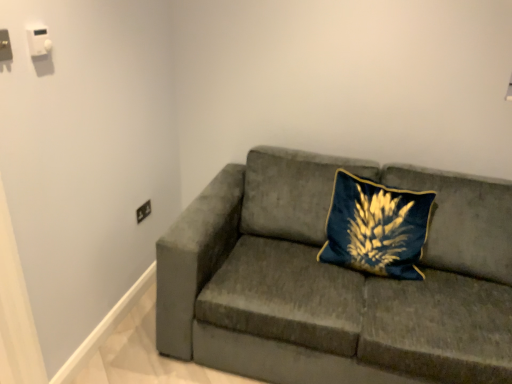
What do you see at coordinates (38, 40) in the screenshot?
I see `white plastic switch at upper left, which is the second electric outlet from right to left` at bounding box center [38, 40].

In order to face velvet gray couch at center, should I rotate leftwards or rightwards?

Rotate right and turn 13.763 degrees.

Image resolution: width=512 pixels, height=384 pixels. What do you see at coordinates (143, 211) in the screenshot? I see `black plastic electrical outlet at lower left, arranged as the 3th electric outlet when viewed from the left` at bounding box center [143, 211].

You are a GUI agent. You are given a task and a screenshot of the screen. Output one action in this format:
    pyautogui.click(x=<x>, y=<y>)
    Task: Click on the white plastic switch at upper left, acting as the second electric outlet starting from the back
    The width and height of the screenshot is (512, 384).
    Given the screenshot: What is the action you would take?
    click(x=38, y=40)

From a real-world perspective, which object rests below the other?

In real-world perspective, black plastic electrical outlet at lower left, which is the 1th electric outlet from right to left, is lower.

You are a GUI agent. You are given a task and a screenshot of the screen. Output one action in this format:
    pyautogui.click(x=<x>, y=<y>)
    Task: Click on the pillow below the black plastic electrical outlet at lower left, which ranks as the 3th electric outlet in front-to-back order (from the image's perspective)
    This screenshot has height=384, width=512.
    Given the screenshot: What is the action you would take?
    pyautogui.click(x=376, y=227)

Considering the relative sizes of black plastic electrical outlet at lower left, placed as the first electric outlet when sorted from bottom to top, and velvet blue pillow at center in the image provided, is black plastic electrical outlet at lower left, placed as the first electric outlet when sorted from bottom to top, smaller than velvet blue pillow at center?

Yes.

Which object is closer to the camera, matte black socket at upper left, positioned as the 1th electric outlet in left-to-right order, or velvet blue pillow at center?

matte black socket at upper left, positioned as the 1th electric outlet in left-to-right order.

In terms of height, does matte black socket at upper left, which ranks as the 3th electric outlet in back-to-front order, look taller or shorter compared to velvet blue pillow at center?

Clearly, matte black socket at upper left, which ranks as the 3th electric outlet in back-to-front order, is shorter compared to velvet blue pillow at center.

From the image's perspective, does matte black socket at upper left, which is the first electric outlet from front to back, appear higher than velvet blue pillow at center?

Indeed, from the image's perspective, matte black socket at upper left, which is the first electric outlet from front to back, is shown above velvet blue pillow at center.

Considering the relative positions of matte black socket at upper left, the second electric outlet viewed from the top, and velvet blue pillow at center in the image provided, is matte black socket at upper left, the second electric outlet viewed from the top, to the right of velvet blue pillow at center from the viewer's perspective?

No, matte black socket at upper left, the second electric outlet viewed from the top, is not to the right of velvet blue pillow at center.

How far apart are white plastic switch at upper left, which ranks as the 2th electric outlet in left-to-right order, and matte black socket at upper left, positioned as the 1th electric outlet in left-to-right order?

A distance of 4.49 inches exists between white plastic switch at upper left, which ranks as the 2th electric outlet in left-to-right order, and matte black socket at upper left, positioned as the 1th electric outlet in left-to-right order.

Does white plastic switch at upper left, marked as the second electric outlet in a front-to-back arrangement, lie in front of matte black socket at upper left, which ranks as the 3th electric outlet in back-to-front order?

No, it is not.

The height and width of the screenshot is (384, 512). Find the location of `electric outlet to the left of white plastic switch at upper left, marked as the second electric outlet in a front-to-back arrangement`. electric outlet to the left of white plastic switch at upper left, marked as the second electric outlet in a front-to-back arrangement is located at coordinates (5, 46).

Is black plastic electrical outlet at lower left, placed as the first electric outlet when sorted from bottom to top, at the right side of matte black socket at upper left, which ranks as the 3th electric outlet in back-to-front order?

Correct, you'll find black plastic electrical outlet at lower left, placed as the first electric outlet when sorted from bottom to top, to the right of matte black socket at upper left, which ranks as the 3th electric outlet in back-to-front order.

Considering the sizes of objects black plastic electrical outlet at lower left, arranged as the 3th electric outlet when viewed from the left, and matte black socket at upper left, which is the first electric outlet from front to back, in the image provided, who is wider, black plastic electrical outlet at lower left, arranged as the 3th electric outlet when viewed from the left, or matte black socket at upper left, which is the first electric outlet from front to back,?

black plastic electrical outlet at lower left, arranged as the 3th electric outlet when viewed from the left.

Does black plastic electrical outlet at lower left, which is the 1th electric outlet from right to left, have a greater height compared to matte black socket at upper left, arranged as the third electric outlet when viewed from the right?

No, black plastic electrical outlet at lower left, which is the 1th electric outlet from right to left, is not taller than matte black socket at upper left, arranged as the third electric outlet when viewed from the right.

From a real-world perspective, which object rests below the other?

black plastic electrical outlet at lower left, which ranks as the 3th electric outlet in front-to-back order.

Which is in front, white plastic switch at upper left, acting as the second electric outlet starting from the back, or velvet blue pillow at center?

white plastic switch at upper left, acting as the second electric outlet starting from the back, is closer to the camera.

Is point (44, 48) closer or farther from the camera than point (429, 203)?

Point (44, 48) appears to be closer to the viewer than point (429, 203).

From a real-world perspective, which object stands above the other?

white plastic switch at upper left, marked as the 3th electric outlet in a bottom-to-top arrangement.

Is white plastic switch at upper left, which ranks as the 2th electric outlet in left-to-right order, beside velvet gray couch at center?

No, white plastic switch at upper left, which ranks as the 2th electric outlet in left-to-right order, is not beside velvet gray couch at center.

Considering the points (38, 36) and (374, 301), which point is behind, point (38, 36) or point (374, 301)?

The point (374, 301) is behind.

How different are the orientations of white plastic switch at upper left, placed as the first electric outlet when sorted from top to bottom, and velvet gray couch at center in degrees?

The facing directions of white plastic switch at upper left, placed as the first electric outlet when sorted from top to bottom, and velvet gray couch at center are 92.8 degrees apart.

Consider the image. Does white plastic switch at upper left, placed as the first electric outlet when sorted from top to bottom, have a smaller size compared to velvet gray couch at center?

Correct, white plastic switch at upper left, placed as the first electric outlet when sorted from top to bottom, occupies less space than velvet gray couch at center.

From the image's perspective, is black plastic electrical outlet at lower left, the first electric outlet viewed from the back, positioned above or below velvet gray couch at center?

From the image's perspective, black plastic electrical outlet at lower left, the first electric outlet viewed from the back, appears above velvet gray couch at center.

Measure the distance between black plastic electrical outlet at lower left, which ranks as the 3th electric outlet in front-to-back order, and velvet gray couch at center.

3.34 feet.

Is black plastic electrical outlet at lower left, which is the 1th electric outlet from right to left, thinner than velvet gray couch at center?

Correct, the width of black plastic electrical outlet at lower left, which is the 1th electric outlet from right to left, is less than that of velvet gray couch at center.

The width and height of the screenshot is (512, 384). Identify the location of pillow on the right of black plastic electrical outlet at lower left, placed as the first electric outlet when sorted from bottom to top. (376, 227).

From the velvet blue pillow at center, count 2nd electric outlets forward and point to it. Please provide its 2D coordinates.

[(5, 46)]

From the image, which object appears to be farther from velvet blue pillow at center, matte black socket at upper left, which ranks as the 3th electric outlet in back-to-front order, or black plastic electrical outlet at lower left, which is the 1th electric outlet from right to left?

matte black socket at upper left, which ranks as the 3th electric outlet in back-to-front order, is further to velvet blue pillow at center.

Estimate the real-world distances between objects in this image. Which object is further from matte black socket at upper left, which is the first electric outlet from front to back, velvet blue pillow at center or white plastic switch at upper left, placed as the first electric outlet when sorted from top to bottom?

velvet blue pillow at center is further to matte black socket at upper left, which is the first electric outlet from front to back.

In the scene shown: From the image, which object appears to be nearer to black plastic electrical outlet at lower left, which is the 1th electric outlet from right to left, matte black socket at upper left, the second electric outlet viewed from the top, or white plastic switch at upper left, placed as the first electric outlet when sorted from top to bottom?

white plastic switch at upper left, placed as the first electric outlet when sorted from top to bottom, lies closer to black plastic electrical outlet at lower left, which is the 1th electric outlet from right to left, than the other object.

From the image, which object appears to be nearer to velvet gray couch at center, velvet blue pillow at center or matte black socket at upper left, which ranks as the 3th electric outlet in back-to-front order?

velvet blue pillow at center lies closer to velvet gray couch at center than the other object.

When comparing their distances from velvet gray couch at center, does white plastic switch at upper left, which ranks as the 2th electric outlet in left-to-right order, or black plastic electrical outlet at lower left, the first electric outlet viewed from the back, seem closer?

black plastic electrical outlet at lower left, the first electric outlet viewed from the back.

From the image, which object appears to be farther from velvet gray couch at center, black plastic electrical outlet at lower left, which is the 1th electric outlet from right to left, or velvet blue pillow at center?

black plastic electrical outlet at lower left, which is the 1th electric outlet from right to left, lies further to velvet gray couch at center than the other object.

When comparing their distances from white plastic switch at upper left, acting as the second electric outlet starting from the back, does matte black socket at upper left, the second electric outlet viewed from the top, or velvet gray couch at center seem closer?

Based on the image, matte black socket at upper left, the second electric outlet viewed from the top, appears to be nearer to white plastic switch at upper left, acting as the second electric outlet starting from the back.

Considering their positions, is velvet gray couch at center positioned closer to matte black socket at upper left, the second electric outlet viewed from the top, than black plastic electrical outlet at lower left, the first electric outlet viewed from the back?

black plastic electrical outlet at lower left, the first electric outlet viewed from the back.

The height and width of the screenshot is (384, 512). What are the coordinates of `studio couch located between black plastic electrical outlet at lower left, which ranks as the 3th electric outlet in front-to-back order, and velvet blue pillow at center in the left-right direction` in the screenshot? It's located at (335, 280).

The height and width of the screenshot is (384, 512). In order to click on electric outlet between matte black socket at upper left, which ranks as the 3th electric outlet in back-to-front order, and black plastic electrical outlet at lower left, the first electric outlet viewed from the back, in the front-back direction in this screenshot , I will do `click(38, 40)`.

The height and width of the screenshot is (384, 512). I want to click on electric outlet located between white plastic switch at upper left, placed as the first electric outlet when sorted from top to bottom, and velvet gray couch at center in the left-right direction, so click(143, 211).

I want to click on studio couch between matte black socket at upper left, which ranks as the 3th electric outlet in back-to-front order, and velvet blue pillow at center, so [x=335, y=280].